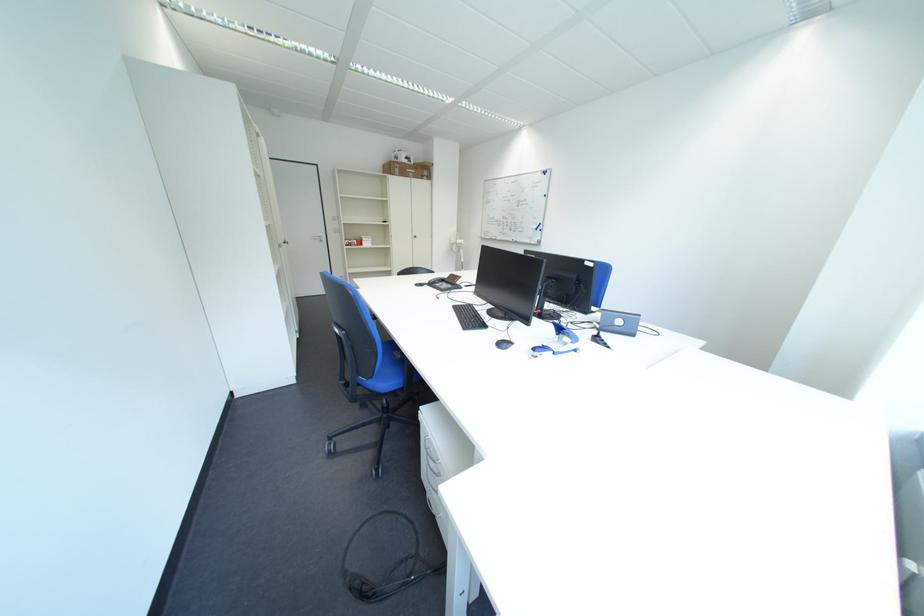
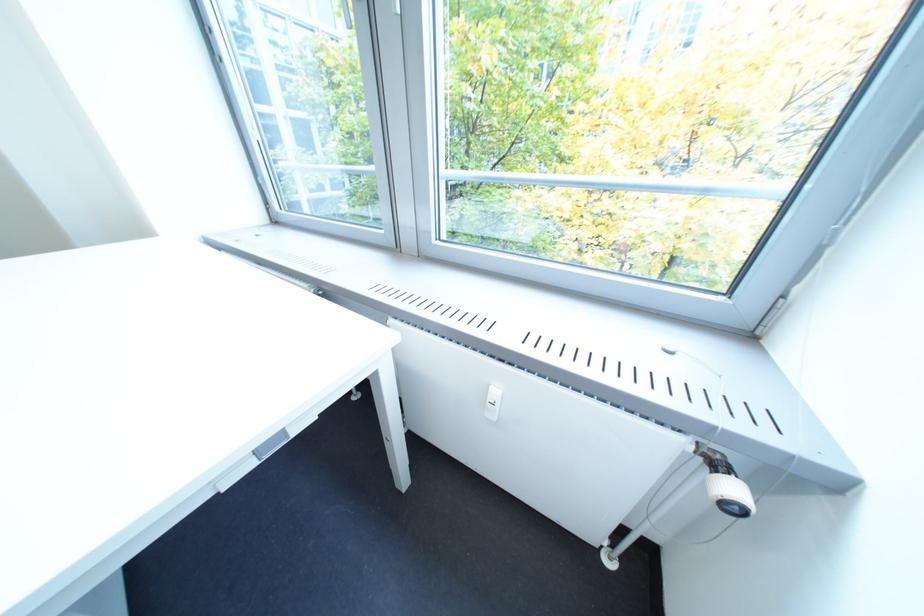
Looking at this image, based on the continuous images, in which direction is the camera rotating?

The rotation direction of the camera is right-down.